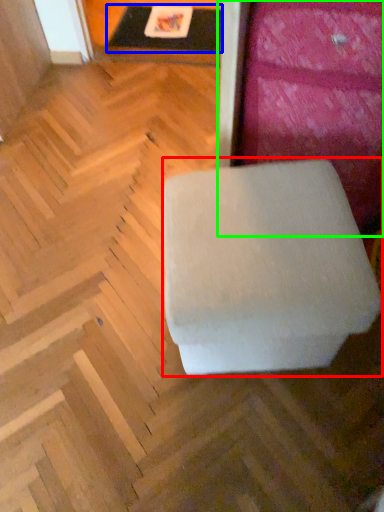
Question: Estimate the real-world distances between objects in this image. Which object is closer to furniture (highlighted by a red box), table (highlighted by a blue box) or furniture (highlighted by a green box)?

Choices:
 (A) table
 (B) furniture

Answer: (B)